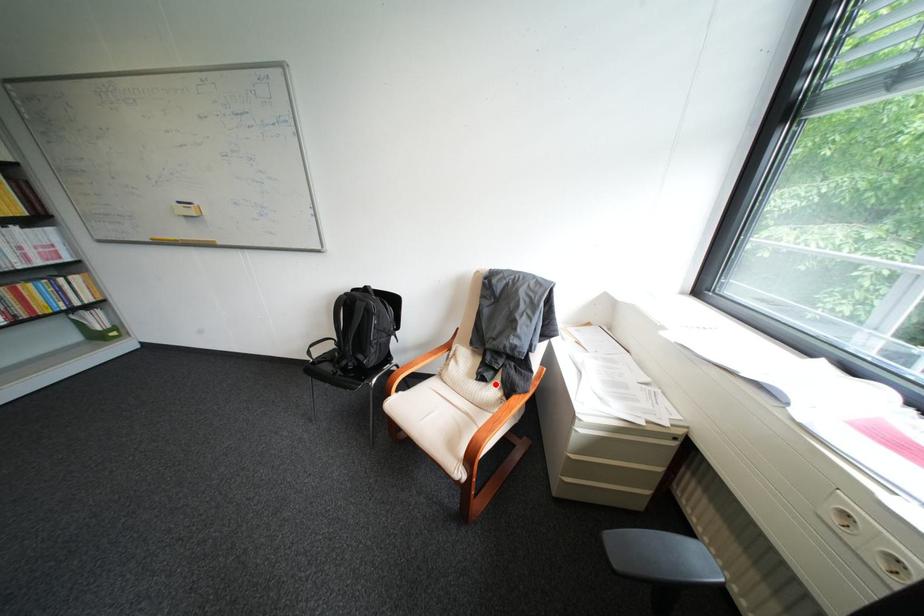
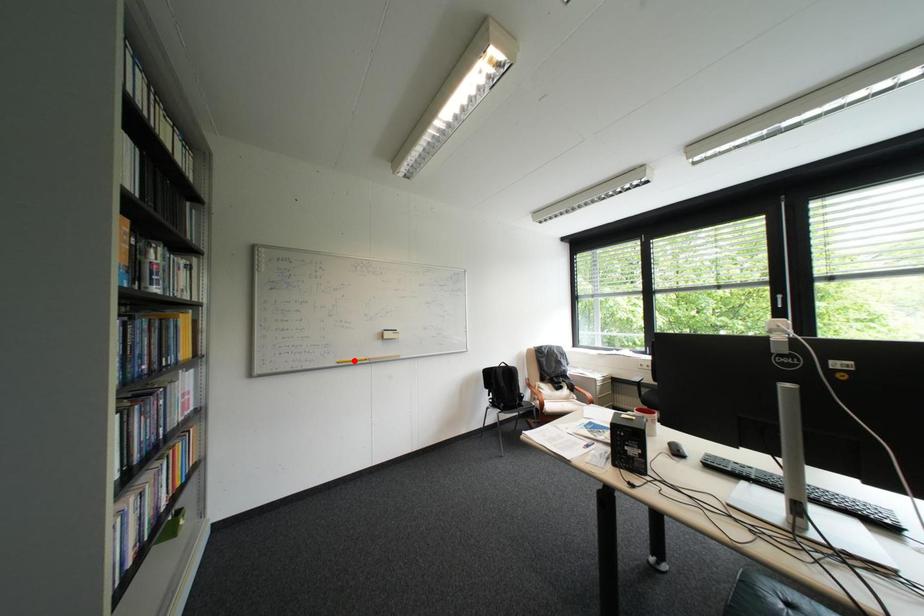
I am providing you with two images of the same scene from different viewpoints. A red point is marked on the first image and another point is marked on the second image. Are the points marked in image1 and image2 representing the same 3D position?

No